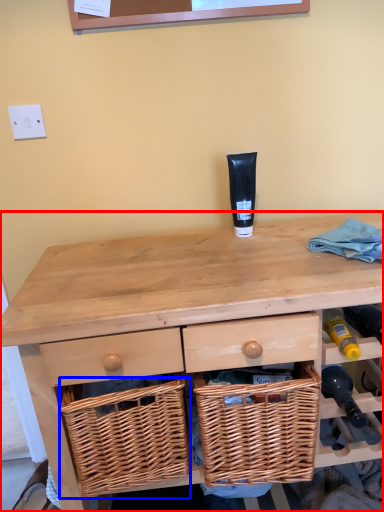
Question: Which point is further to the camera, desk (highlighted by a red box) or basket (highlighted by a blue box)?

Choices:
 (A) desk
 (B) basket

Answer: (B)